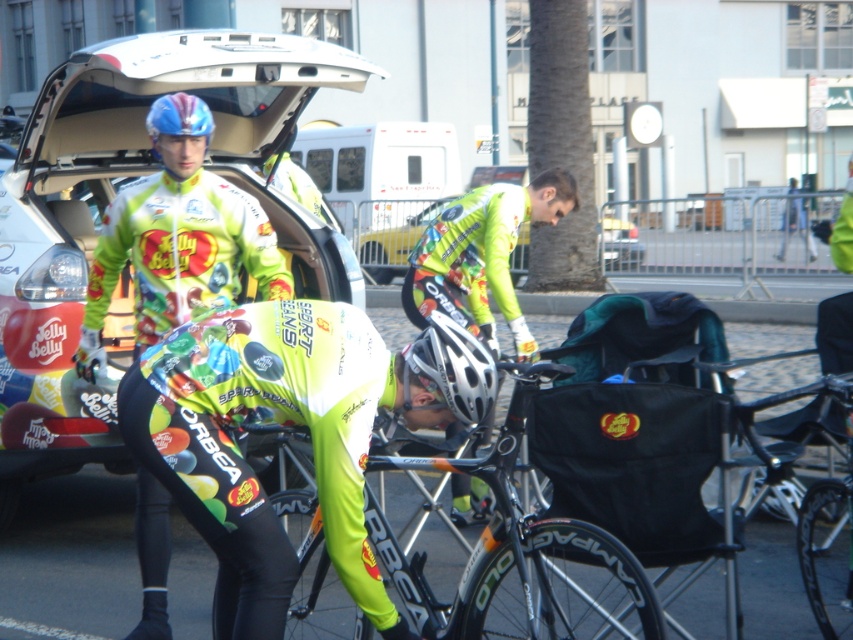
You are a photographer trying to capture a clear shot of the neon green jersey at center without any obstructions. Given the presence of the matte white car at center, is there a risk that the car might block your view of the jersey?

The matte white car at center is positioned over neon green jersey at center, so yes, the car will block the view of the jersey.

You are standing at the point labeled point (42, 125) in the image. If you want to move towards the viewer, which direction should you go?

Since the point (42, 125) is 27.50 feet away from the viewer, you should move towards the viewer by going in the direction opposite to where the point is located relative to the viewer.